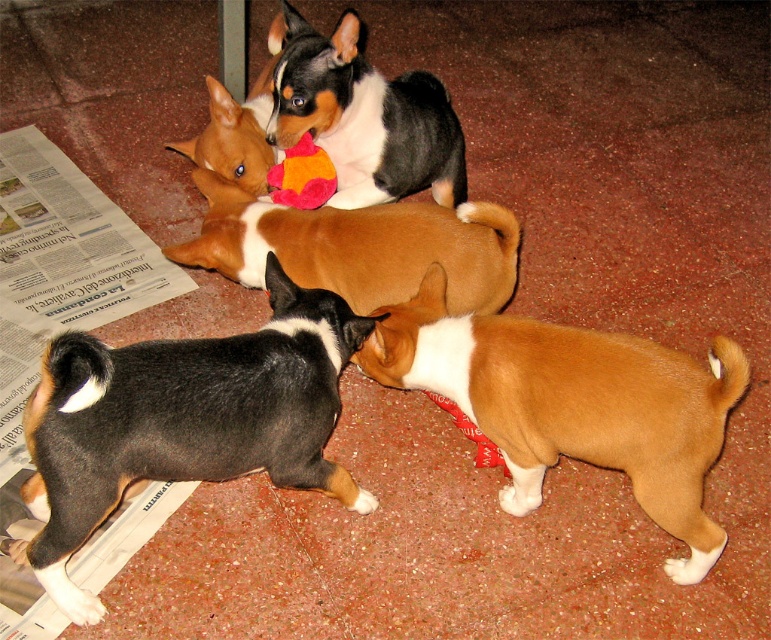
Question: Which of the following is the closest to the observer?

Choices:
 (A) (180, 474)
 (B) (281, 189)
 (C) (476, 428)
 (D) (490, 237)

Answer: (A)

Question: Considering the relative positions of brown fur at upper left and soft plush toy at center in the image provided, where is brown fur at upper left located with respect to soft plush toy at center?

Choices:
 (A) right
 (B) left

Answer: (B)

Question: Is black and tan fur at lower left thinner than brown furry dog at center?

Choices:
 (A) no
 (B) yes

Answer: (B)

Question: Which point is closer to the camera?

Choices:
 (A) black and tan fur at lower left
 (B) brown furry dog at center

Answer: (A)

Question: Which object appears farthest from the camera in this image?

Choices:
 (A) soft plush toy at center
 (B) black and tan fur at lower left
 (C) red plush toy at center

Answer: (A)

Question: Where is brown furry puppy at center located in relation to red plush toy at center in the image?

Choices:
 (A) left
 (B) right

Answer: (B)